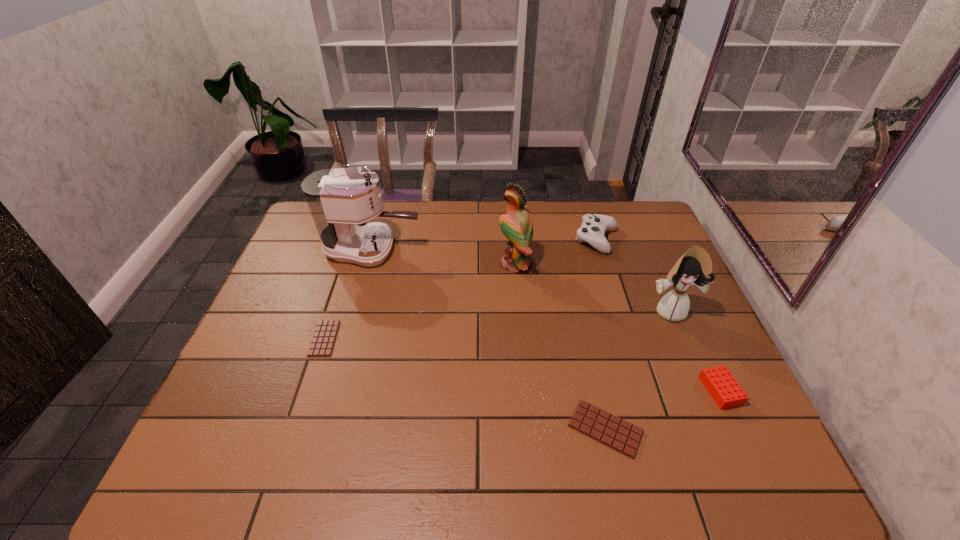
Locate an element on the screen. blank area at the near edge is located at coordinates (516, 430).

Identify the location of free space at the left edge of the desktop. (268, 345).

Identify the location of vacant area at the right edge of the desktop. The height and width of the screenshot is (540, 960). (669, 255).

In the image, there is a desktop. Where is `vacant area at the near left corner`? vacant area at the near left corner is located at coordinates (275, 417).

The image size is (960, 540). I want to click on vacant area at the far right corner, so click(615, 217).

In order to click on free region at the near right corner of the desktop in this screenshot , I will do `click(708, 426)`.

Locate an element on the screen. This screenshot has width=960, height=540. free space between the fourth shortest object and the nearer candy bar is located at coordinates (x=601, y=334).

The height and width of the screenshot is (540, 960). Find the location of `free space between the control and the Lego`. free space between the control and the Lego is located at coordinates (659, 315).

You are a GUI agent. You are given a task and a screenshot of the screen. Output one action in this format:
    pyautogui.click(x=<x>, y=<y>)
    Task: Click on the free spot between the right candy bar and the coffee maker
    This screenshot has height=540, width=960.
    Given the screenshot: What is the action you would take?
    (489, 339)

Where is `free space that is in between the shorter candy bar and the coffee maker`? free space that is in between the shorter candy bar and the coffee maker is located at coordinates (348, 294).